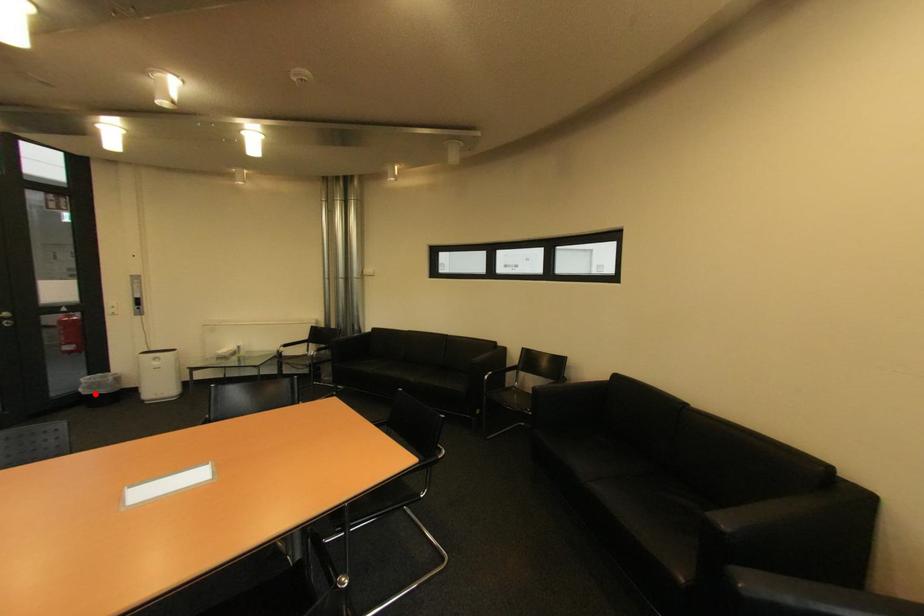
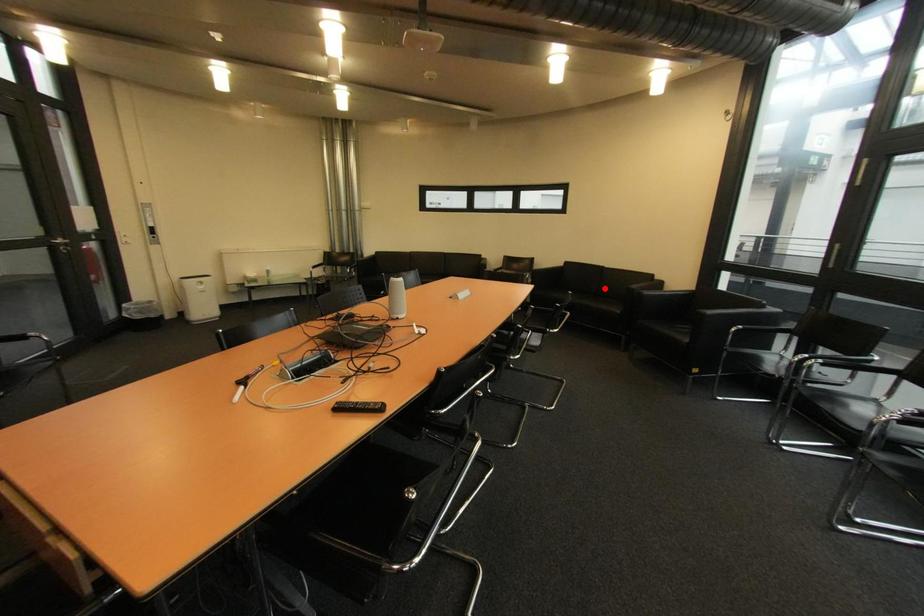
I am providing you with two images of the same scene from different viewpoints. A red point is marked on the first image and another point is marked on the second image. Do the highlighted points in image1 and image2 indicate the same real-world spot?

No